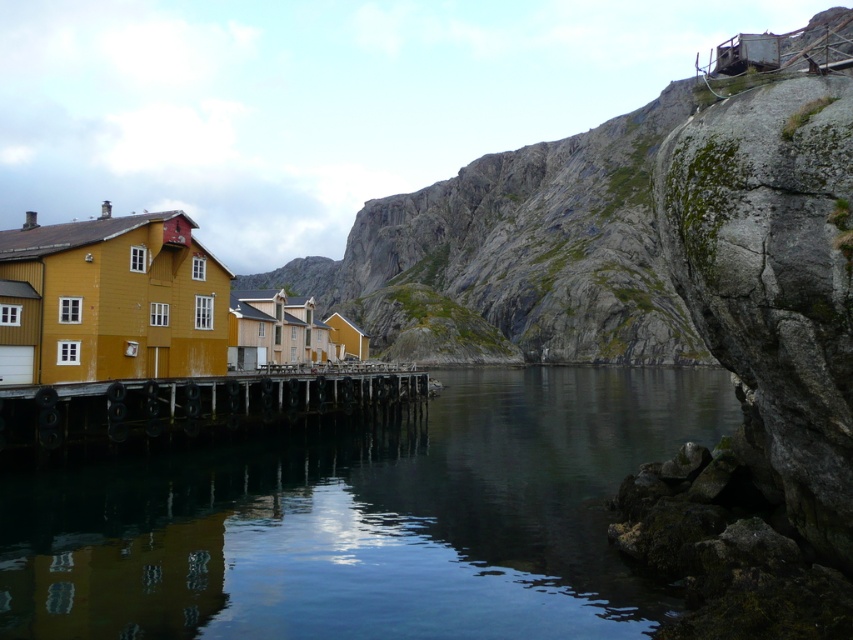
You are standing on the wooden planks at center and want to step down into the clear water at center. Is the water directly below you?

Yes, the clear water at center is located below the wooden planks at center, so stepping down would place you directly into the water.